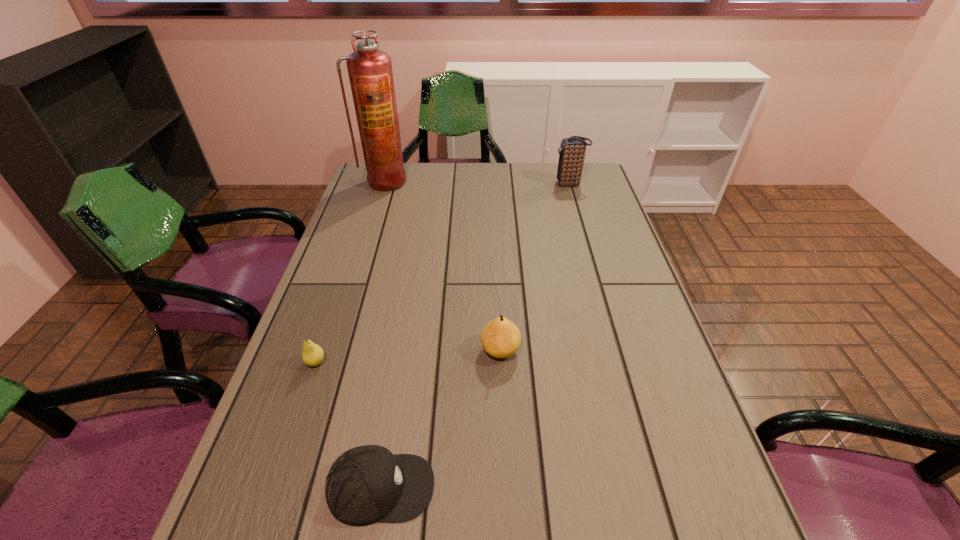
Locate an element on the screen. The height and width of the screenshot is (540, 960). vacant space that is in between the clutch bag and the left pear is located at coordinates (443, 273).

The image size is (960, 540). In order to click on vacant area between the tallest object and the taller pear in this screenshot , I will do `click(443, 266)`.

Image resolution: width=960 pixels, height=540 pixels. What are the coordinates of `vacant space that's between the taller pear and the shorter pear` in the screenshot? It's located at (408, 356).

Find the location of a particular element. The width and height of the screenshot is (960, 540). free space between the tallest object and the third tallest object is located at coordinates (443, 266).

Where is `vacant area that lies between the left pear and the cap`? The height and width of the screenshot is (540, 960). vacant area that lies between the left pear and the cap is located at coordinates (348, 425).

Identify which object is located as the third nearest to the cap. Please provide its 2D coordinates. Your answer should be formatted as a tuple, i.e. [(x, y)], where the tuple contains the x and y coordinates of a point satisfying the conditions above.

[(370, 72)]

I want to click on object identified as the closest to the cap, so click(x=312, y=354).

The width and height of the screenshot is (960, 540). In order to click on vacant space that satisfies the following two spatial constraints: 1. with the zip open on the fourth shortest object; 2. on the front side of the shorter pear in this screenshot , I will do `click(622, 362)`.